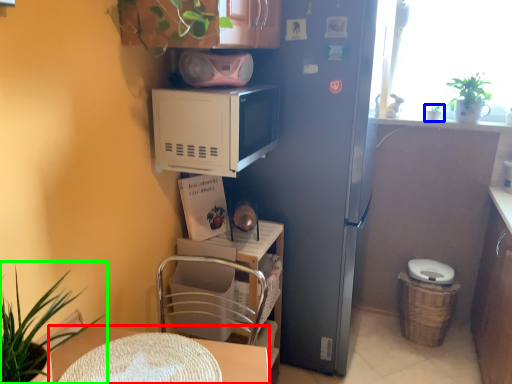
Question: Considering the real-world distances, which object is closest to desk (highlighted by a red box)? houseplant (highlighted by a blue box) or houseplant (highlighted by a green box).

Choices:
 (A) houseplant
 (B) houseplant

Answer: (B)